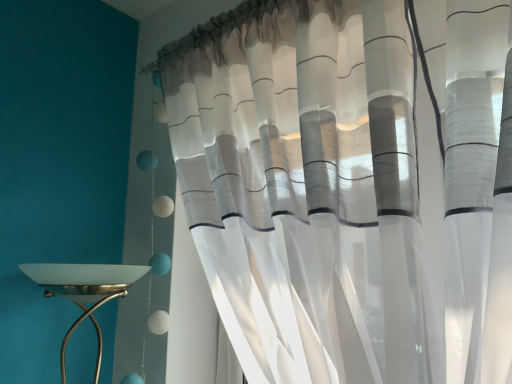
The height and width of the screenshot is (384, 512). What do you see at coordinates (336, 183) in the screenshot?
I see `sheer white curtain at upper center` at bounding box center [336, 183].

You are a GUI agent. You are given a task and a screenshot of the screen. Output one action in this format:
    pyautogui.click(x=<x>, y=<y>)
    Task: Click on the sheer white curtain at upper center
    The image size is (512, 384).
    Given the screenshot: What is the action you would take?
    pyautogui.click(x=336, y=183)

The height and width of the screenshot is (384, 512). Find the location of `sheer white curtain at upper center`. sheer white curtain at upper center is located at coordinates (336, 183).